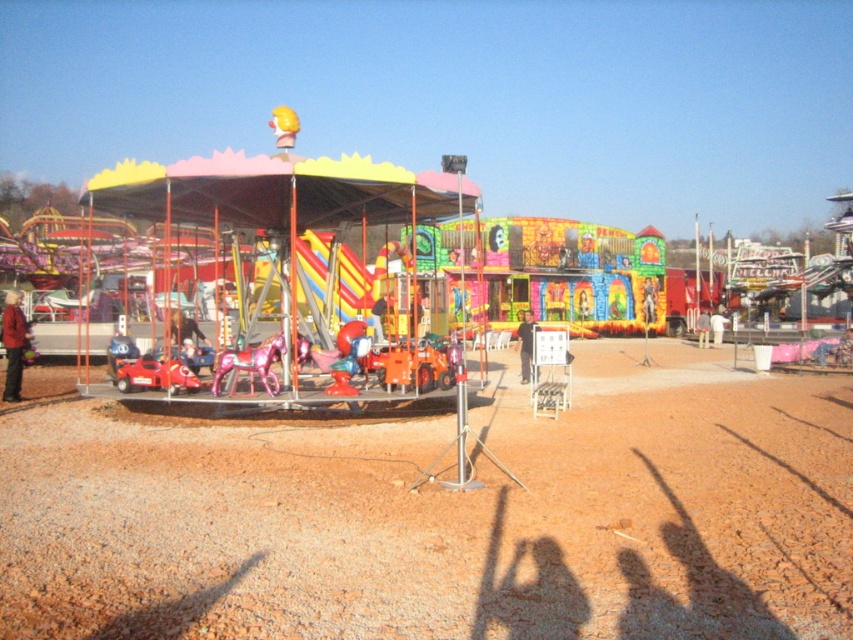
Looking at this image, does metallic carousel at center appear under black matte person at center?

Actually, metallic carousel at center is above black matte person at center.

In the scene shown: Who is shorter, metallic carousel at center or black matte person at center?

black matte person at center is shorter.

The height and width of the screenshot is (640, 853). What are the coordinates of `metallic carousel at center` in the screenshot? It's located at (292, 264).

Identify the location of brown gravel at center. (444, 515).

Is point (554, 628) more distant than point (316, 259)?

No, (554, 628) is closer to viewer.

Does point (757, 426) come closer to viewer compared to point (241, 163)?

No, (757, 426) is further to viewer.

At what (x,y) coordinates should I click in order to perform the action: click on brown gravel at center. Please return your answer as a coordinate pair (x, y). Looking at the image, I should click on (444, 515).

Does brown gravel at center have a lesser width compared to red leather jacket at left?

No, brown gravel at center is not thinner than red leather jacket at left.

Can you confirm if brown gravel at center is wider than red leather jacket at left?

Correct, the width of brown gravel at center exceeds that of red leather jacket at left.

What do you see at coordinates (444, 515) in the screenshot? I see `brown gravel at center` at bounding box center [444, 515].

Where is `brown gravel at center`? Image resolution: width=853 pixels, height=640 pixels. brown gravel at center is located at coordinates (444, 515).